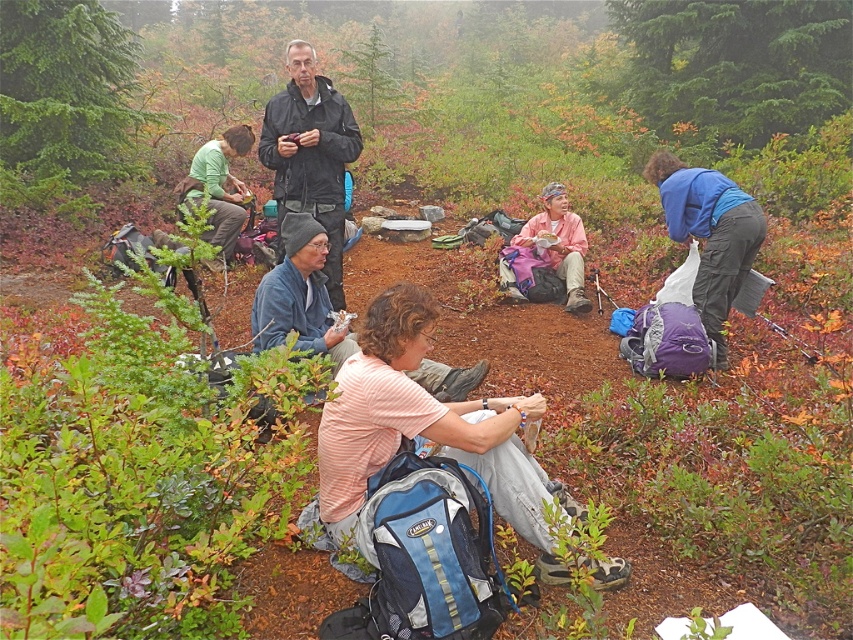
Question: Considering the relative positions of black matte jacket at center and pink fabric at center in the image provided, where is black matte jacket at center located with respect to pink fabric at center?

Choices:
 (A) below
 (B) above

Answer: (B)

Question: Estimate the real-world distances between objects in this image. Which object is farther from the striped cotton shirt at center?

Choices:
 (A) black matte jacket at center
 (B) pink fabric at center

Answer: (B)

Question: Does striped cotton shirt at center appear on the right side of pink fabric at center?

Choices:
 (A) no
 (B) yes

Answer: (A)

Question: Which object appears closest to the camera in this image?

Choices:
 (A) striped cotton shirt at center
 (B) black matte jacket at center
 (C) pink fabric at center

Answer: (A)

Question: Is striped cotton shirt at center positioned behind pink fabric at center?

Choices:
 (A) no
 (B) yes

Answer: (A)

Question: Which is nearer to the black matte jacket at center?

Choices:
 (A) striped cotton shirt at center
 (B) pink fabric at center

Answer: (B)